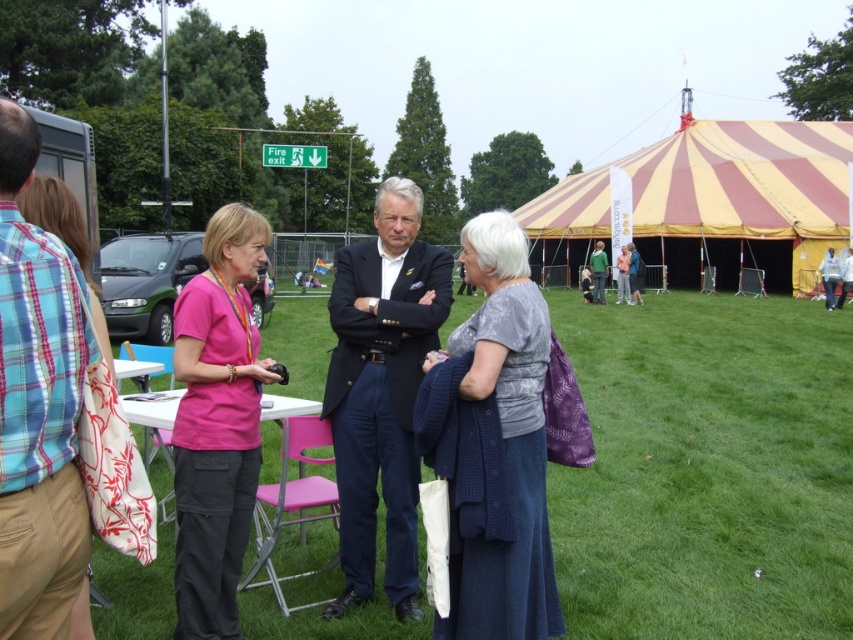
You are at a festival and see two people in the crowd. One is wearing a plaid cotton shirt at left and the other is wearing a gray textured dress at center. Which one is positioned more to the left side of the scene?

The plaid cotton shirt at left is positioned more to the left side of the scene compared to the gray textured dress at center.

You are a photographer at the event and want to capture both the gray textured dress at center and the green fabric jacket at center in the same frame. Which direction should you move your camera to include both?

The gray textured dress at center is to the left of the green fabric jacket at center. To include both in the frame, move your camera to the left to capture the gray textured dress at center and then pan towards the right to include the green fabric jacket at center.

You are a photographer at the event and need to capture a group photo of the plaid cotton shirt at left and the gray textured dress at center. The camera you have can focus on subjects within a 1.5 meter range. Will both subjects be in focus?

The distance between the plaid cotton shirt at left and gray textured dress at center is 1.83 meters. Since the camera can only focus within 1.5 meters, the subjects will not both be in focus.